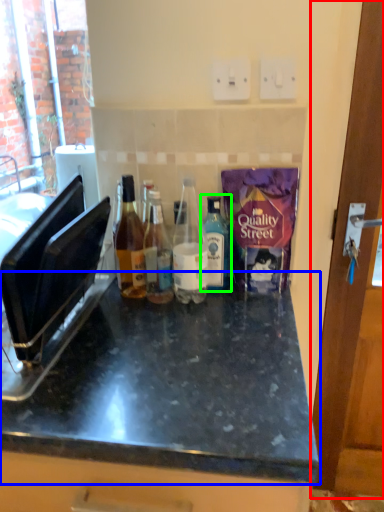
Question: Considering the real-world distances, which object is farthest from door (highlighted by a red box)? countertop (highlighted by a blue box) or bottle (highlighted by a green box)?

Choices:
 (A) countertop
 (B) bottle

Answer: (A)